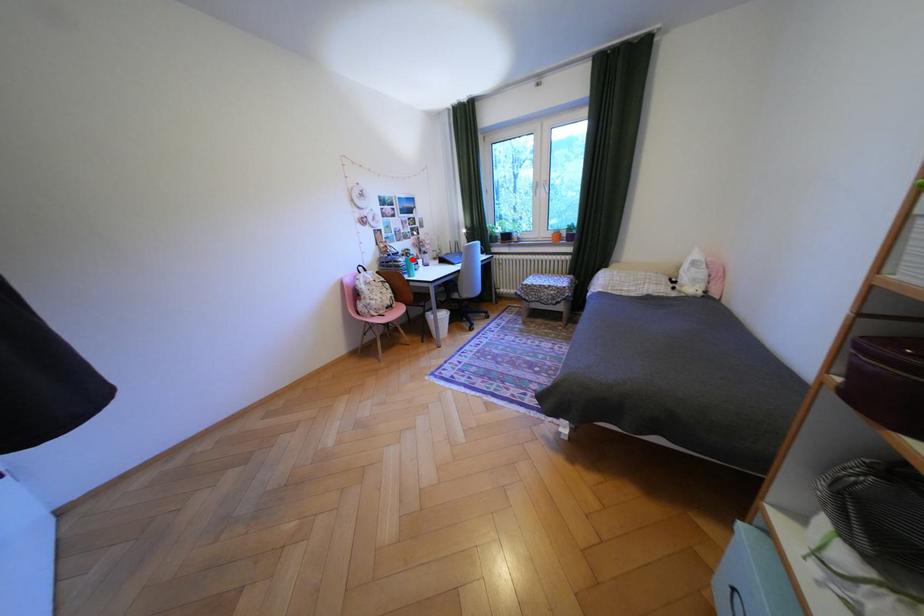
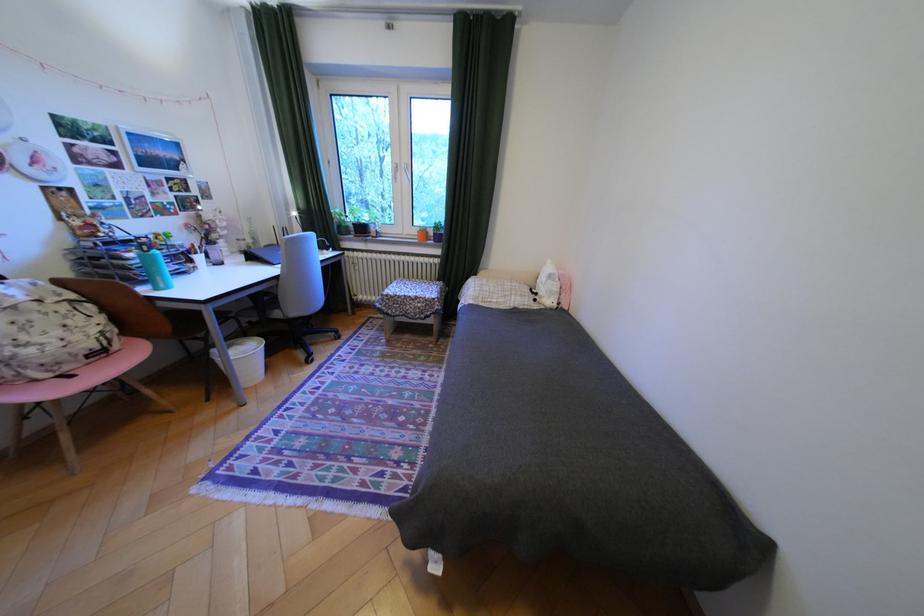
Question: I am providing you with two images of the same scene from different viewpoints. In image1, a red point is highlighted. Considering the same 3D point in image2, which of the following is correct?

Choices:
 (A) It is closer
 (B) It is farther

Answer: (B)